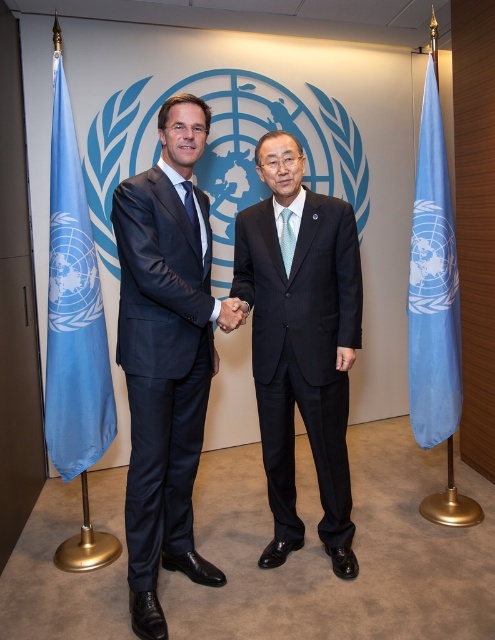
Question: Does blue fabric flag at left have a smaller size compared to blue silk tie at center?

Choices:
 (A) yes
 (B) no

Answer: (B)

Question: Can you confirm if blue fabric flag at left is thinner than black leather hand at center?

Choices:
 (A) yes
 (B) no

Answer: (B)

Question: Which point is closer to the camera?

Choices:
 (A) dark blue pinstripe suit at center
 (B) light blue silk tie at center
 (C) blue fabric flag at left
 (D) blue fabric flag at right

Answer: (A)

Question: Does dark blue pinstripe suit at center appear on the left side of blue fabric flag at right?

Choices:
 (A) yes
 (B) no

Answer: (A)

Question: Which of these objects is positioned closest to the blue silk tie at center?

Choices:
 (A) matte black suit at center
 (B) dark blue pinstripe suit at center

Answer: (A)

Question: Which point is closer to the camera?

Choices:
 (A) (185, 189)
 (B) (209, 333)
 (C) (245, 316)
 (D) (288, 241)

Answer: (C)